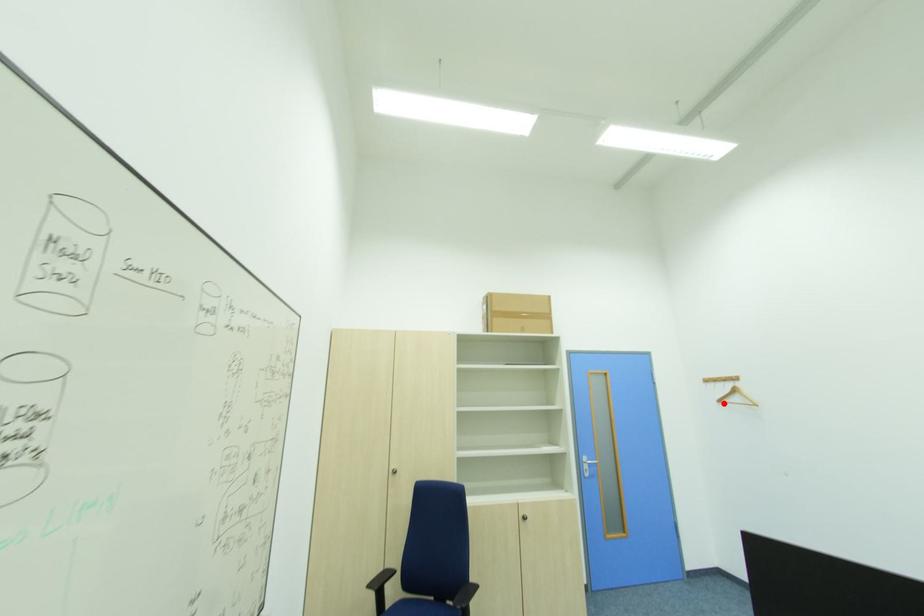
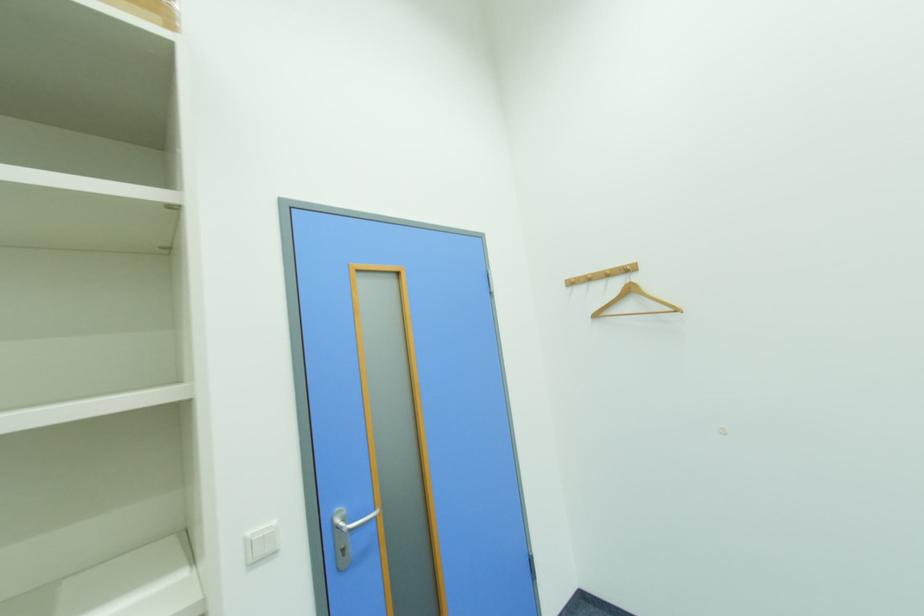
Question: I am providing you with two images of the same scene from different viewpoints. A red point is marked on the first image. Can you still see the location of the red point in image 2?

Choices:
 (A) Yes
 (B) No

Answer: (A)